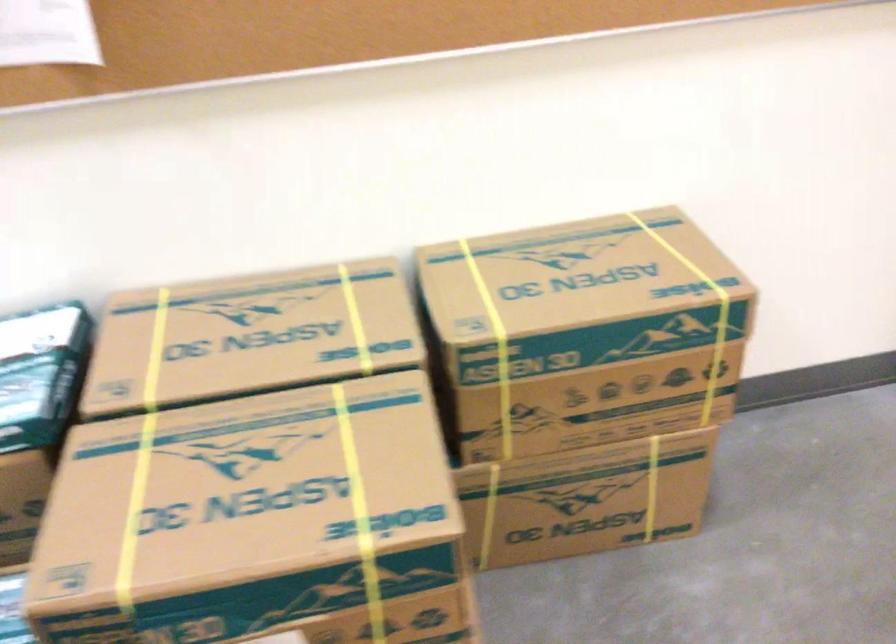
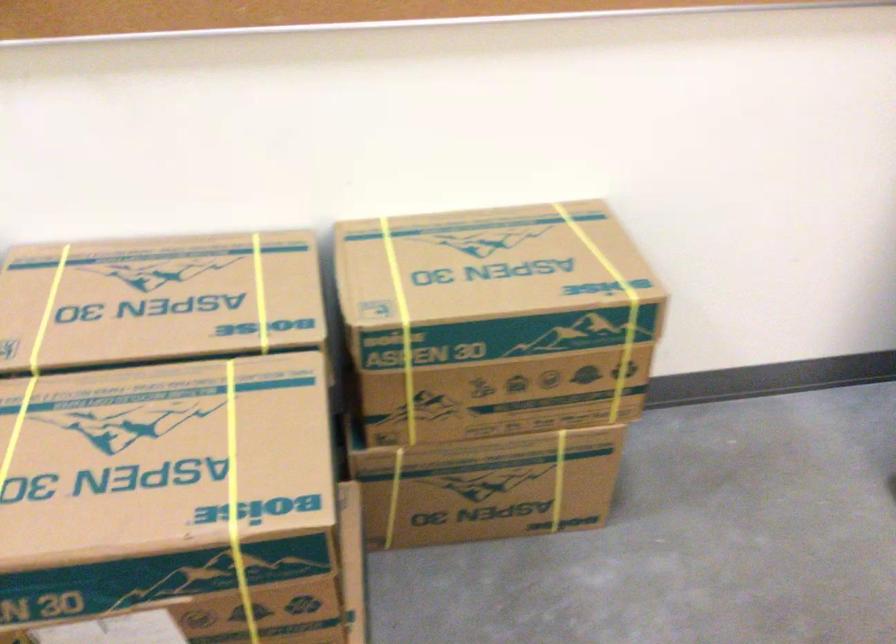
Where in the second image is the point corresponding to point (352, 321) from the first image?

(260, 292)